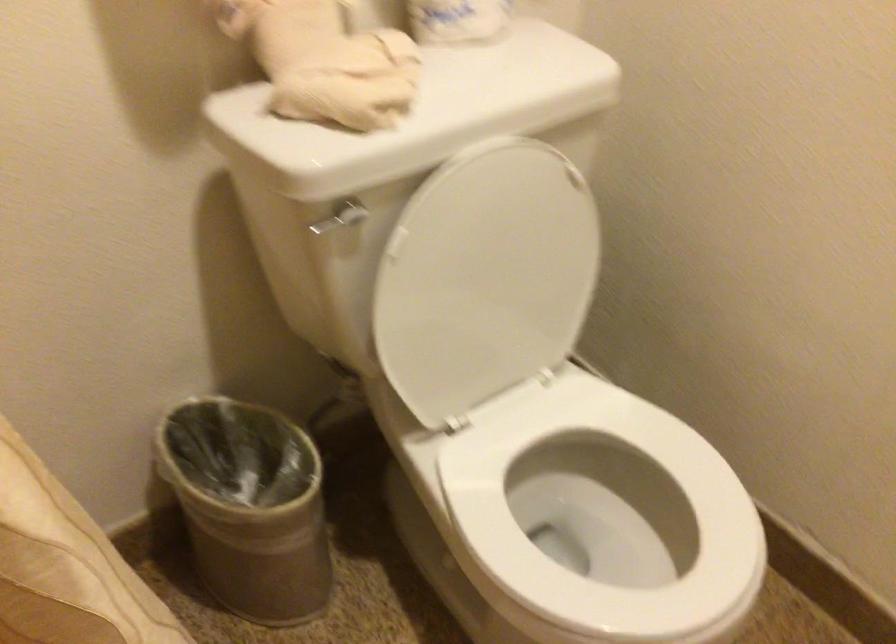
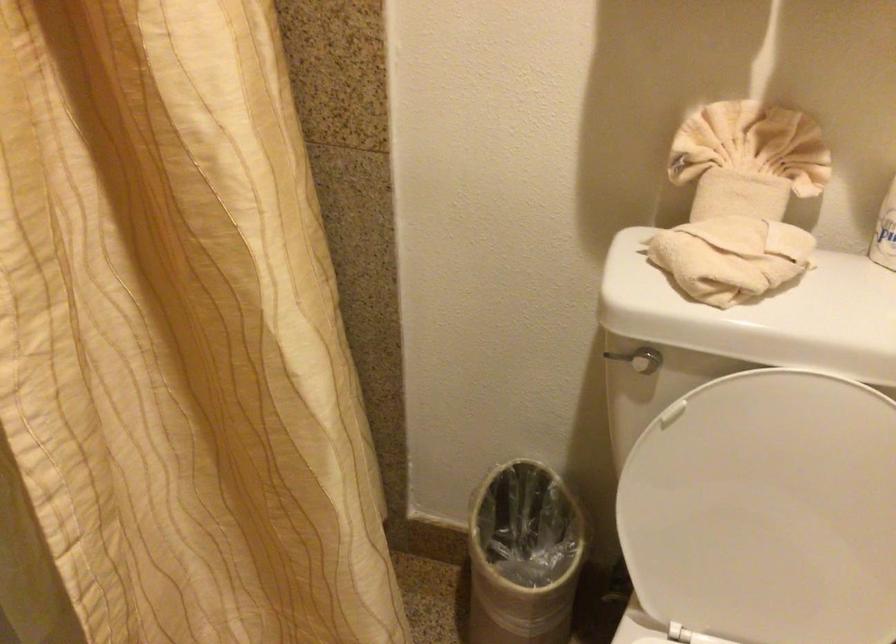
In the second image, find the point that corresponds to the point at 375,73 in the first image.

(730, 257)